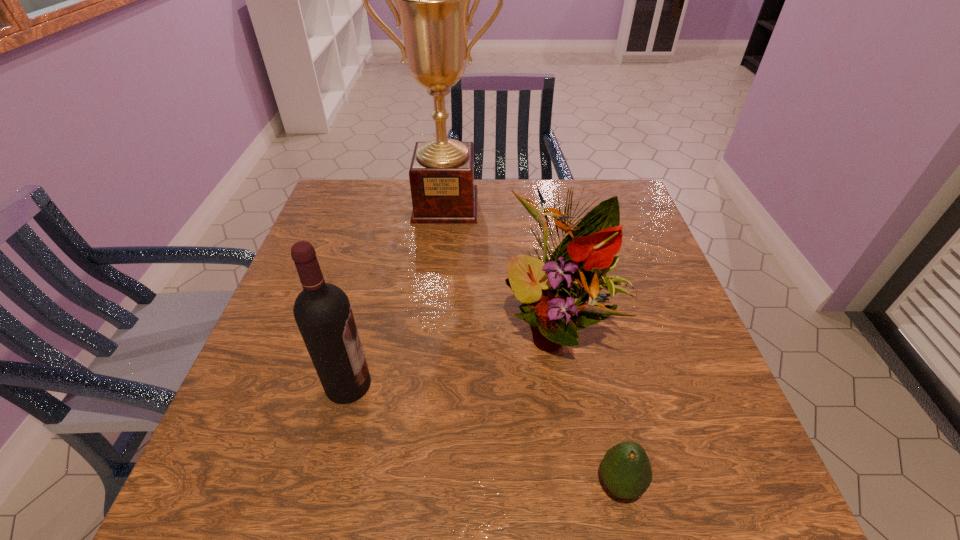
This screenshot has width=960, height=540. Identify the location of object that is at the far edge. (433, 0).

Identify the location of object that is at the near edge. (626, 470).

Where is `vacant space at the left edge of the desktop`? This screenshot has height=540, width=960. vacant space at the left edge of the desktop is located at coordinates (293, 295).

Find the location of a particular element. vacant space at the right edge of the desktop is located at coordinates (619, 325).

This screenshot has height=540, width=960. Find the location of `vacant space at the far left corner of the desktop`. vacant space at the far left corner of the desktop is located at coordinates (374, 185).

At what (x,y) coordinates should I click in order to perform the action: click on vacant space at the far right corner. Please return your answer as a coordinate pair (x, y). The image size is (960, 540). Looking at the image, I should click on (595, 200).

The width and height of the screenshot is (960, 540). Find the location of `free space between the nearest object and the wine bottle`. free space between the nearest object and the wine bottle is located at coordinates point(484,434).

You are a GUI agent. You are given a task and a screenshot of the screen. Output one action in this format:
    pyautogui.click(x=<x>, y=<y>)
    Task: Click on the free spot between the bouquet and the wine bottle
    This screenshot has height=540, width=960.
    Given the screenshot: What is the action you would take?
    pyautogui.click(x=452, y=356)

Image resolution: width=960 pixels, height=540 pixels. Identify the location of free spot between the bouquet and the trophy cup. (501, 266).

This screenshot has width=960, height=540. What are the coordinates of `blank region between the wine bottle and the nearest object` in the screenshot? It's located at (484, 434).